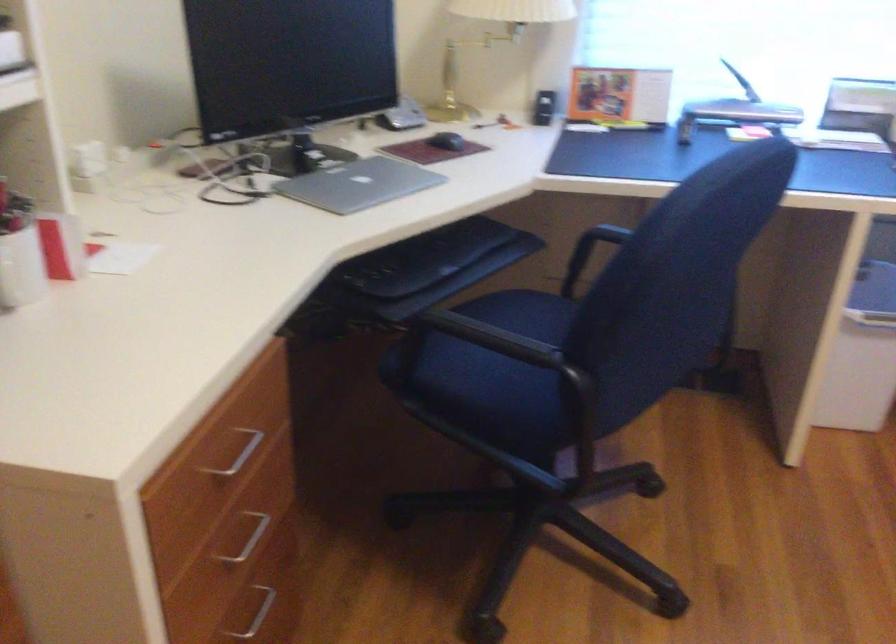
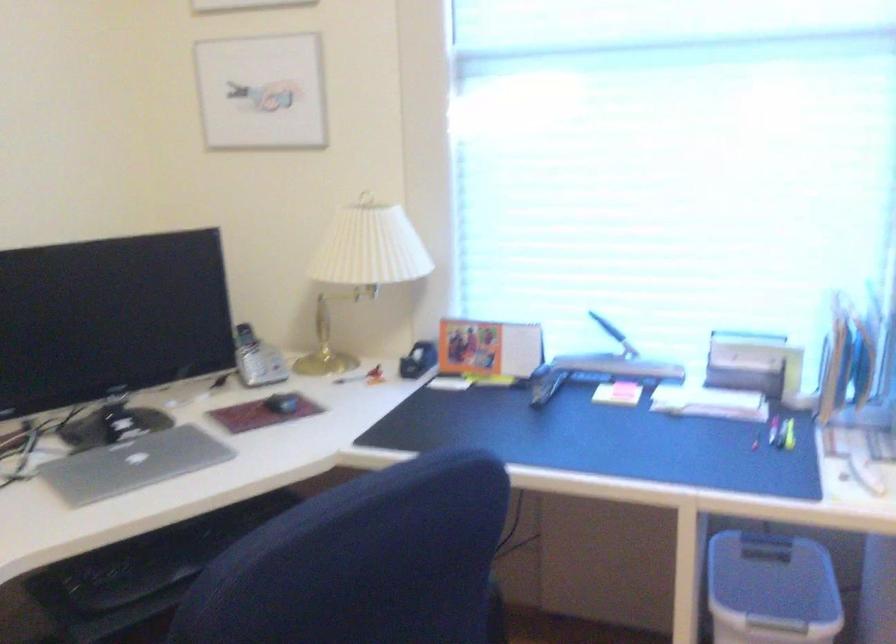
Question: How did the camera likely rotate?

Choices:
 (A) Left
 (B) Right
 (C) Up
 (D) Down

Answer: (C)